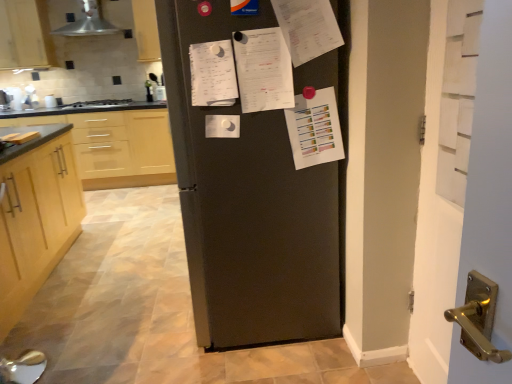
This screenshot has width=512, height=384. Identify the location of light wood cabinet at left, the 1th cabinetry positioned from the bottom. (36, 222).

What do you see at coordinates (99, 103) in the screenshot?
I see `black matte gas stove at left` at bounding box center [99, 103].

Describe the element at coordinates (263, 70) in the screenshot. I see `white paper at center, placed as the second list when sorted from left to right` at that location.

Where is `white matte paper at center`? The width and height of the screenshot is (512, 384). white matte paper at center is located at coordinates (222, 126).

Which point is more forward, (476,378) or (227,111)?

The point (476,378) is more forward.

Based on the photo, from the image's perspective, is white painted wood door at right located beneath matte black fridge at center?

Indeed, from the image's perspective, white painted wood door at right is shown beneath matte black fridge at center.

Is there a large distance between white painted wood door at right and matte black fridge at center?

Actually, white painted wood door at right and matte black fridge at center are a little close together.

Find the location of `refrigerator that is behind the white painted wood door at right`. refrigerator that is behind the white painted wood door at right is located at coordinates (248, 205).

At what (x,y) coordinates should I click in order to perform the action: click on the 2nd cabinetry to the right of the matte wood cabinet at upper left, which appears as the 1th cabinetry when viewed from the top, counting from the anchor's position. Please return your answer as a coordinate pair (x, y). This screenshot has width=512, height=384. Looking at the image, I should click on (36, 222).

Is matte wood cabinet at upper left, the 2th cabinetry from the front, located outside light wood cabinet at left, arranged as the 3th cabinetry when viewed from the top?

matte wood cabinet at upper left, the 2th cabinetry from the front, is positioned outside light wood cabinet at left, arranged as the 3th cabinetry when viewed from the top.

Can you see matte wood cabinet at upper left, the 3th cabinetry positioned from the bottom, touching light wood cabinet at left, arranged as the 3th cabinetry when viewed from the top?

No, matte wood cabinet at upper left, the 3th cabinetry positioned from the bottom, is not touching light wood cabinet at left, arranged as the 3th cabinetry when viewed from the top.

Considering their positions, is matte wood cabinet at upper left, the 2th cabinetry from the front, located in front of or behind light wood cabinet at left, the first cabinetry from the front?

Visually, matte wood cabinet at upper left, the 2th cabinetry from the front, is located behind light wood cabinet at left, the first cabinetry from the front.

From the image's perspective, which object appears higher, white paper at upper right or black matte gas stove at left?

black matte gas stove at left, from the image's perspective.

Which is less distant, [312,119] or [82,105]?

The point [312,119] is closer to the camera.

Looking at this image, from a real-world perspective, which is physically above, white paper at upper right or black matte gas stove at left?

From a 3D spatial view, white paper at upper right is above.

In order to click on gas stove lying behind the white paper at upper right in this screenshot , I will do `click(99, 103)`.

Can you confirm if light wood cabinet at left, the 1th cabinetry positioned from the bottom, is shorter than white matte paper at center?

No.

From the image's perspective, is light wood cabinet at left, arranged as the 3th cabinetry when viewed from the top, positioned above or below white matte paper at center?

From the image's perspective, light wood cabinet at left, arranged as the 3th cabinetry when viewed from the top, appears below white matte paper at center.

In terms of size, does light wood cabinet at left, the first cabinetry from the front, appear bigger or smaller than white matte paper at center?

Clearly, light wood cabinet at left, the first cabinetry from the front, is larger in size than white matte paper at center.

Is light wood cabinetry at left, the third cabinetry positioned from the front, positioned beyond the bounds of matte wood cabinet at upper left, the 2th cabinetry from the front?

Indeed, light wood cabinetry at left, the third cabinetry positioned from the front, is completely outside matte wood cabinet at upper left, the 2th cabinetry from the front.

From a real-world perspective, is light wood cabinetry at left, the 1th cabinetry viewed from the back, positioned above or below matte wood cabinet at upper left, which appears as the second cabinetry when viewed from the back?

From a real-world perspective, light wood cabinetry at left, the 1th cabinetry viewed from the back, is physically below matte wood cabinet at upper left, which appears as the second cabinetry when viewed from the back.

How distant is light wood cabinetry at left, the third cabinetry positioned from the front, from matte wood cabinet at upper left, the 3th cabinetry positioned from the bottom?

light wood cabinetry at left, the third cabinetry positioned from the front, is 7.03 feet away from matte wood cabinet at upper left, the 3th cabinetry positioned from the bottom.

From a real-world perspective, who is located lower, black matte gas stove at left or white paper at center, which appears as the 1th list when viewed from the right?

black matte gas stove at left is physically lower.

Is black matte gas stove at left facing towards white paper at center, which appears as the 1th list when viewed from the right?

No, black matte gas stove at left is not oriented towards white paper at center, which appears as the 1th list when viewed from the right.

How many degrees apart are the facing directions of black matte gas stove at left and white paper at center, which appears as the 1th list when viewed from the right?

0.754 degrees.

Is white paper at center, placed as the second list when sorted from left to right, surrounded by black matte gas stove at left?

No, white paper at center, placed as the second list when sorted from left to right, is not a part of black matte gas stove at left.

From the image's perspective, would you say metallic silver exhaust hood at upper left is positioned over matte black fridge at center?

Correct, metallic silver exhaust hood at upper left appears higher than matte black fridge at center in the image.

Relative to matte black fridge at center, is metallic silver exhaust hood at upper left in front or behind?

Visually, metallic silver exhaust hood at upper left is located behind matte black fridge at center.

Find the location of a particular element. The width and height of the screenshot is (512, 384). exhaust hood above the matte black fridge at center (from a real-world perspective) is located at coordinates (88, 23).

This screenshot has height=384, width=512. I want to click on refrigerator to the left of white painted wood door at right, so click(x=248, y=205).

Locate an element on the screen. Image resolution: width=512 pixels, height=384 pixels. the 1st cabinetry behind the light wood cabinet at left, the first cabinetry from the front is located at coordinates (25, 35).

When comparing their distances from white matte paper at center, does black matte gas stove at left or white paper at upper right seem further?

The object further to white matte paper at center is black matte gas stove at left.

Which object lies nearer to the anchor point light wood cabinetry at left, the third cabinetry positioned from the front, light wood cabinet at left, the 1th cabinetry positioned from the bottom, or metallic silver exhaust hood at upper left?

Among the two, light wood cabinet at left, the 1th cabinetry positioned from the bottom, is located nearer to light wood cabinetry at left, the third cabinetry positioned from the front.

From the picture: Considering their positions, is white paper at upper right positioned further to light wood cabinetry at left, the 1th cabinetry viewed from the back, than white painted wood door at right?

white painted wood door at right lies further to light wood cabinetry at left, the 1th cabinetry viewed from the back, than the other object.

Based on their spatial positions, is black matte gas stove at left or matte wood cabinet at upper left, the 3th cabinetry positioned from the bottom, closer to light wood cabinetry at left, which ranks as the 2th cabinetry in top-to-bottom order?

black matte gas stove at left.

Consider the image. Which object lies nearer to the anchor point light wood cabinetry at left, the third cabinetry positioned from the front, white painted wood door at right or white paper at upper right?

white paper at upper right is positioned closer to the anchor light wood cabinetry at left, the third cabinetry positioned from the front.

Based on their spatial positions, is metallic silver exhaust hood at upper left or white paper at upper right closer to white paper at center, placed as the second list when sorted from left to right?

white paper at upper right lies closer to white paper at center, placed as the second list when sorted from left to right, than the other object.

Considering their positions, is matte black fridge at center positioned further to white paper at upper right than matte wood cabinet at upper left, the 3th cabinetry positioned from the bottom?

matte wood cabinet at upper left, the 3th cabinetry positioned from the bottom, lies further to white paper at upper right than the other object.

From the image, which object appears to be farther from white painted wood door at right, light wood cabinetry at left, the 2th cabinetry positioned from the bottom, or light wood cabinet at left, the first cabinetry from the front?

The object further to white painted wood door at right is light wood cabinetry at left, the 2th cabinetry positioned from the bottom.

This screenshot has height=384, width=512. I want to click on cabinetry positioned between matte black fridge at center and matte wood cabinet at upper left, which appears as the 1th cabinetry when viewed from the top, from near to far, so click(x=36, y=222).

Find the location of a particular element. The width and height of the screenshot is (512, 384). paper located between light wood cabinet at left, which is counted as the third cabinetry, starting from the back, and matte black fridge at center in the left-right direction is located at coordinates (222, 126).

The width and height of the screenshot is (512, 384). I want to click on exhaust hood between matte wood cabinet at upper left, which appears as the second cabinetry when viewed from the back, and black matte gas stove at left from left to right, so pos(88,23).

Identify the location of exhaust hood between white paper at upper right and black matte gas stove at left along the z-axis. (88, 23).